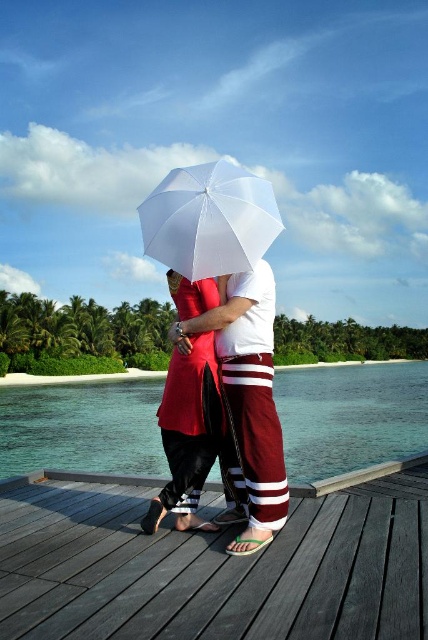
Question: Which object is positioned farthest from the dark wood dock at center?

Choices:
 (A) maroon striped pants at center
 (B) white matte umbrella at center
 (C) clear blue water at center

Answer: (C)

Question: Does clear blue water at center have a larger size compared to white matte umbrella at center?

Choices:
 (A) yes
 (B) no

Answer: (A)

Question: Can you confirm if clear blue water at center is bigger than maroon striped pants at center?

Choices:
 (A) yes
 (B) no

Answer: (A)

Question: Which object is closer to the camera taking this photo?

Choices:
 (A) white matte umbrella at center
 (B) matte red dress at center
 (C) maroon striped pants at center
 (D) dark wood dock at center

Answer: (D)

Question: Can you confirm if clear blue water at center is wider than white matte umbrella at center?

Choices:
 (A) yes
 (B) no

Answer: (A)

Question: Which point appears closest to the camera in this image?

Choices:
 (A) (65, 419)
 (B) (240, 184)
 (C) (151, 508)
 (D) (86, 632)

Answer: (D)